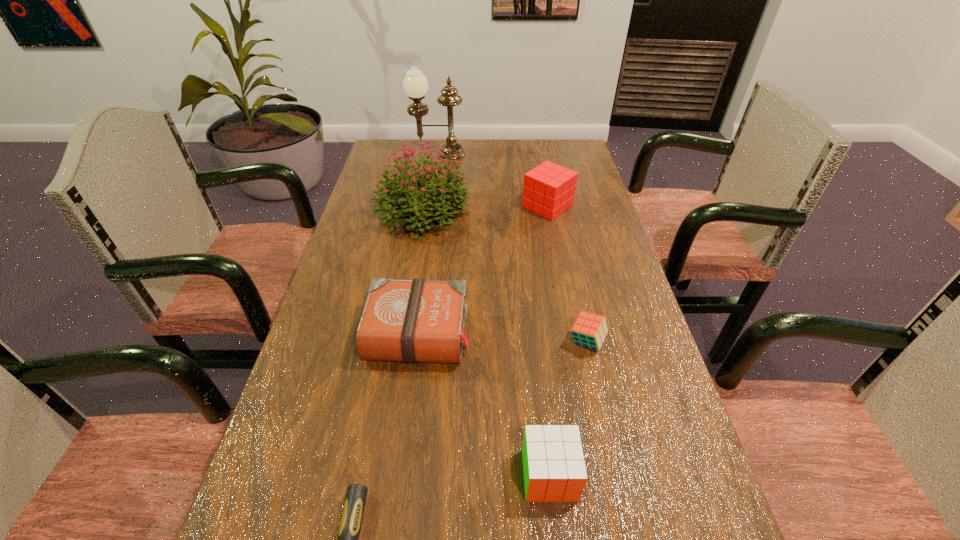
Where is `the tallest object`? This screenshot has width=960, height=540. the tallest object is located at coordinates (415, 84).

Locate an element on the screen. Image resolution: width=960 pixels, height=540 pixels. oil lamp is located at coordinates (415, 84).

At what (x,y) coordinates should I click in order to perform the action: click on the sixth shortest object. Please return your answer as a coordinate pair (x, y). The image size is (960, 540). Looking at the image, I should click on (435, 181).

The height and width of the screenshot is (540, 960). I want to click on the fifth shortest object, so click(549, 189).

I want to click on the farthest cube, so click(549, 189).

This screenshot has height=540, width=960. I want to click on Bible, so click(411, 321).

Where is `the nearest cube`? The width and height of the screenshot is (960, 540). the nearest cube is located at coordinates (554, 469).

I want to click on the second shortest object, so click(x=589, y=330).

Locate an element on the screen. The height and width of the screenshot is (540, 960). the shortest cube is located at coordinates (589, 330).

You are a GUI agent. You are given a task and a screenshot of the screen. Output one action in this format:
    pyautogui.click(x=<x>, y=<y>)
    Task: Click on the vacant space situated 0.130m on the front of the tallest object
    The image size is (960, 540).
    Given the screenshot: What is the action you would take?
    pyautogui.click(x=434, y=179)